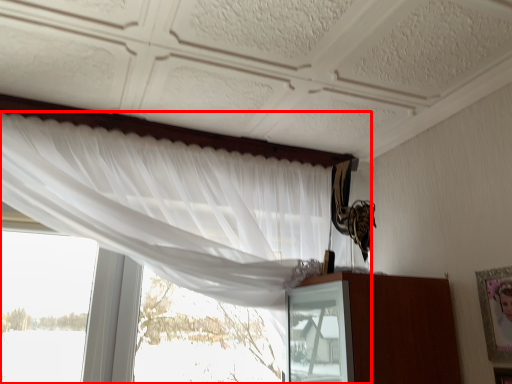
Question: Observing the image, what is the correct spatial positioning of curtain (annotated by the red box) in reference to picture frame?

Choices:
 (A) right
 (B) left

Answer: (B)